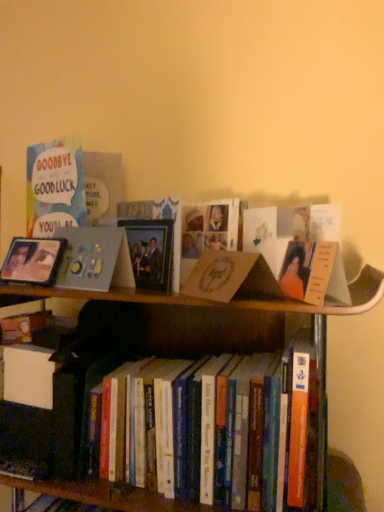
Question: Which is correct: matte gray photo frame at upper left is inside hardcover books at center, or outside of it?

Choices:
 (A) outside
 (B) inside

Answer: (A)

Question: Would you say matte gray photo frame at upper left is to the left or to the right of hardcover books at center in the picture?

Choices:
 (A) right
 (B) left

Answer: (B)

Question: Based on their relative distances, which object is farther from the matte silver picture frame at left?

Choices:
 (A) brown cardboard book at center
 (B) hardcover books at center
 (C) matte gray photo frame at upper left

Answer: (B)

Question: Estimate the real-world distances between objects in this image. Which object is farther from the hardcover books at center?

Choices:
 (A) brown cardboard book at center
 (B) matte gray photo frame at upper left
 (C) matte silver picture frame at left

Answer: (C)